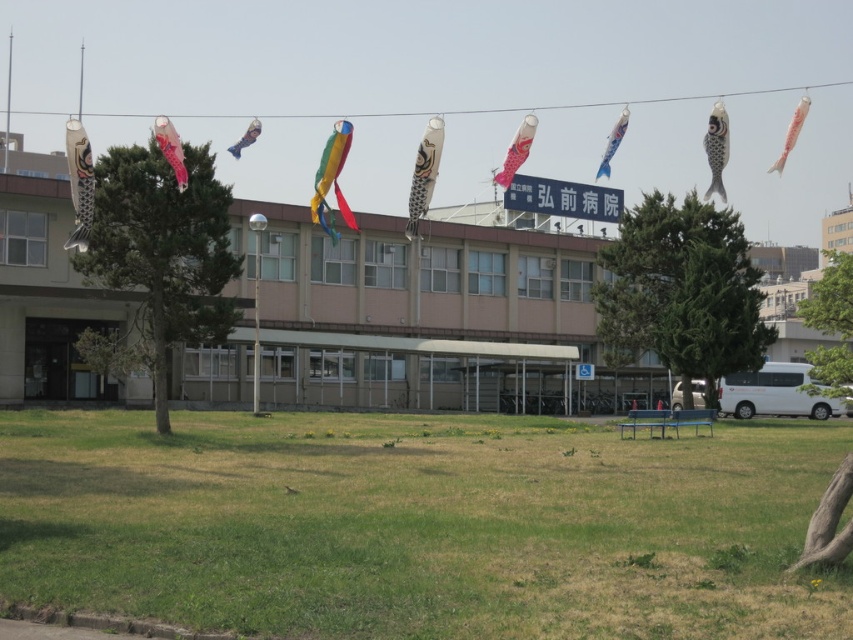
Question: Which object is positioned closest to the green grass at lower center?

Choices:
 (A) green leafy tree at lower right
 (B) matte blue kite at upper center
 (C) matte black kite at left

Answer: (A)

Question: Estimate the real-world distances between objects in this image. Which object is farther from the rainbow fabric kite at center?

Choices:
 (A) white paper kite at center
 (B) green grass at lower center
 (C) green textured tree at center
 (D) white matte kite at upper right

Answer: (D)

Question: Which object appears farthest from the camera in this image?

Choices:
 (A) rainbow fabric kite at center
 (B) white paper kite at center
 (C) black and white patterned kite at upper right

Answer: (A)

Question: Is green grass at lower center further to the viewer compared to white paper kite at center?

Choices:
 (A) yes
 (B) no

Answer: (B)

Question: Can you confirm if black and white patterned kite at upper right is positioned below white matte kite at upper right?

Choices:
 (A) yes
 (B) no

Answer: (A)

Question: Is green textured tree at center below white matte kite at upper right?

Choices:
 (A) no
 (B) yes

Answer: (B)